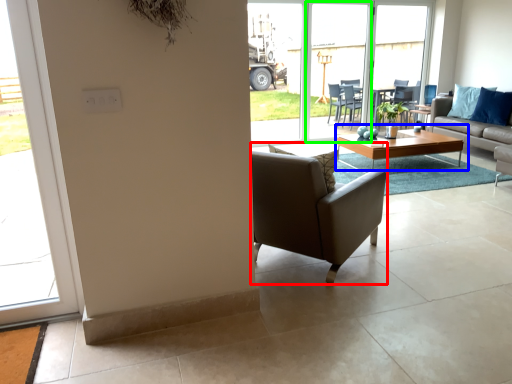
Question: Estimate the real-world distances between objects in this image. Which object is farther from chair (highlighted by a red box), coffee table (highlighted by a blue box) or screen door (highlighted by a green box)?

Choices:
 (A) coffee table
 (B) screen door

Answer: (B)